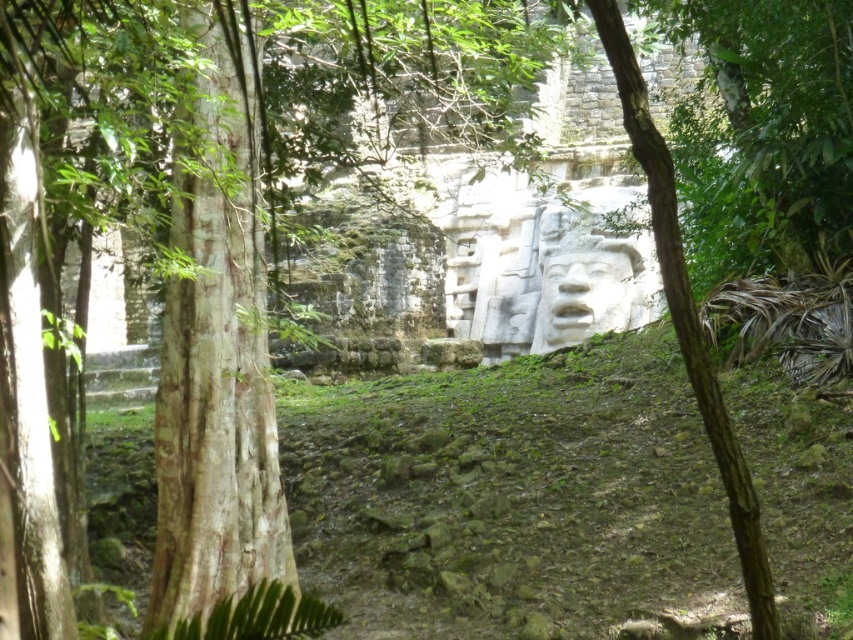
Measure the distance between white stone carving at center and white stone face at center.

white stone carving at center is 17.99 inches from white stone face at center.

Where is `white stone carving at center`? white stone carving at center is located at coordinates point(583,280).